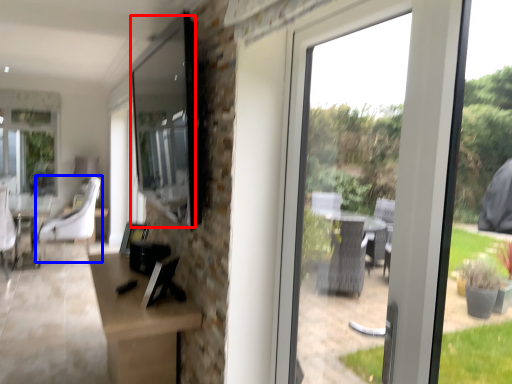
Question: Among these objects, which one is farthest to the camera, window screen (highlighted by a red box) or chair (highlighted by a blue box)?

Choices:
 (A) window screen
 (B) chair

Answer: (B)